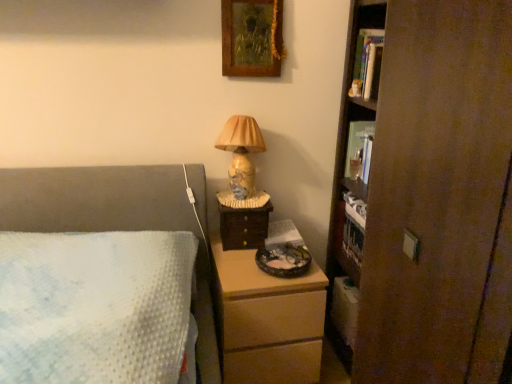
I want to click on vacant area on top of wooden chest of drawers at lower center (from a real-world perspective), so 257,261.